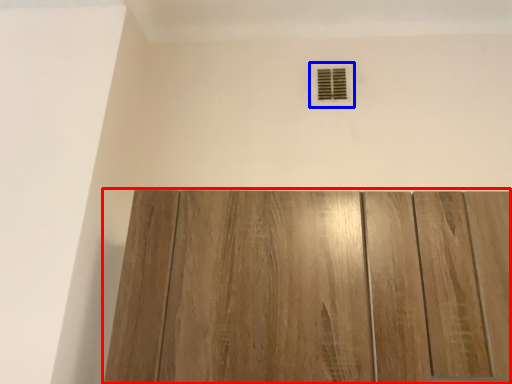
Question: Which object is closer to the camera taking this photo, door (highlighted by a red box) or air conditioning (highlighted by a blue box)?

Choices:
 (A) door
 (B) air conditioning

Answer: (A)